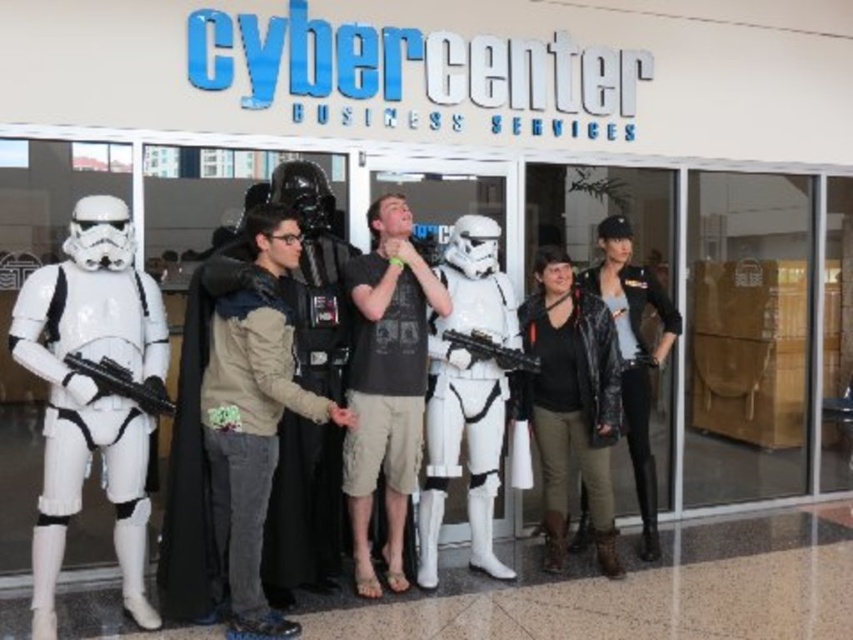
Based on the photo, you are standing at the entrance of the Cybercenter Business Services building and want to take a photo of the white matte stormtrooper at left. According to the scene description, where should you position yourself to capture the stormtrooper in the frame?

Result: Position yourself at the entrance of the Cybercenter Business Services building and aim your camera towards the left side, specifically at the coordinates point (91,394), to capture the white matte stormtrooper at left in the frame.

You are a photographer at the Cybercenter Business Services. You need to arrange the white matte stormtrooper at left and the dark matte costume at center in a line for a group photo. Which one should be placed in the back row to avoid blocking the view of the others?

The white matte stormtrooper at left should be placed in the back row because it is much taller than the dark matte costume at center, so positioning it behind would prevent it from blocking the view of the shorter costume.